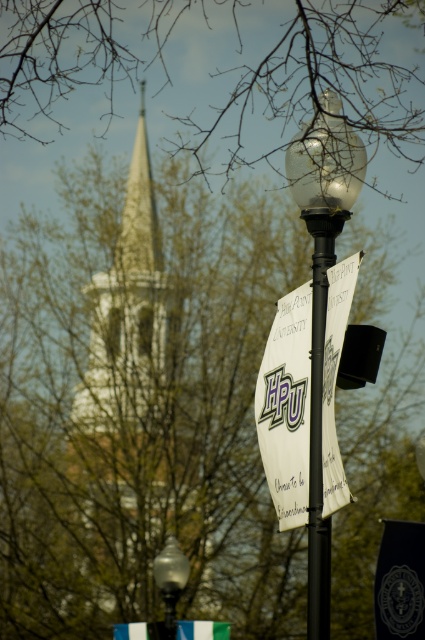
Question: Is the position of black metal pole at center less distant than that of matte glass street light at lower left?

Choices:
 (A) yes
 (B) no

Answer: (A)

Question: Which object is the farthest from the matte glass street light at center?

Choices:
 (A) bare branches at upper center
 (B) matte glass street light at lower left

Answer: (A)

Question: Is bare branches at upper center above matte glass street light at lower left?

Choices:
 (A) no
 (B) yes

Answer: (B)

Question: Among these points, which one is farthest from the camera?

Choices:
 (A) (286, 294)
 (B) (158, 627)
 (C) (28, 1)

Answer: (A)

Question: Can you confirm if white stone tower at upper center is positioned to the right of matte glass street light at lower left?

Choices:
 (A) no
 (B) yes

Answer: (A)

Question: Which object appears farthest from the camera in this image?

Choices:
 (A) bare branches at upper center
 (B) white paper sign at center

Answer: (A)